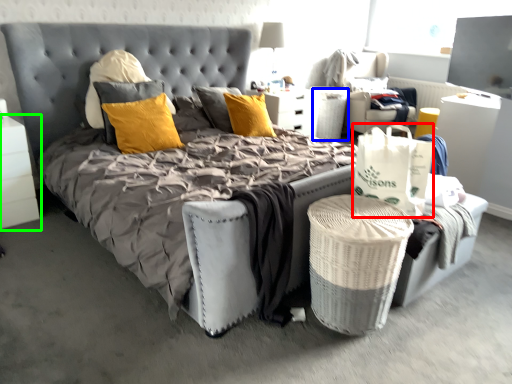
Question: Which object is the closest to the shopping bag (highlighted by a red box)? Choose among these: basket (highlighted by a blue box) or nightstand (highlighted by a green box).

Choices:
 (A) basket
 (B) nightstand

Answer: (B)